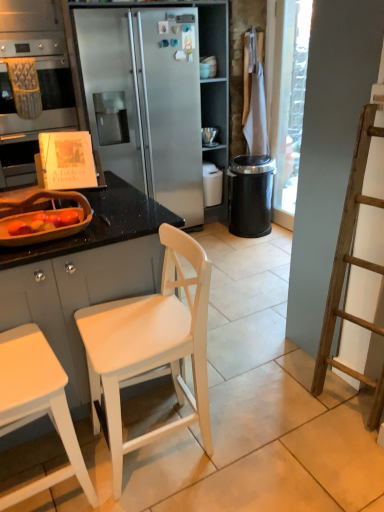
Identify the location of free point below white matte desk at lower left (from a real-world perspective). Image resolution: width=384 pixels, height=512 pixels. (48, 490).